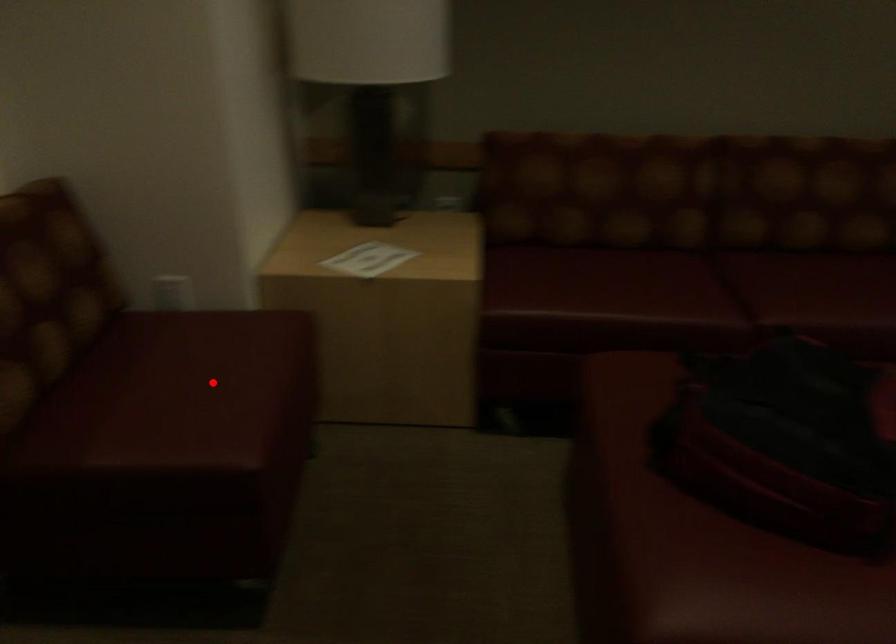
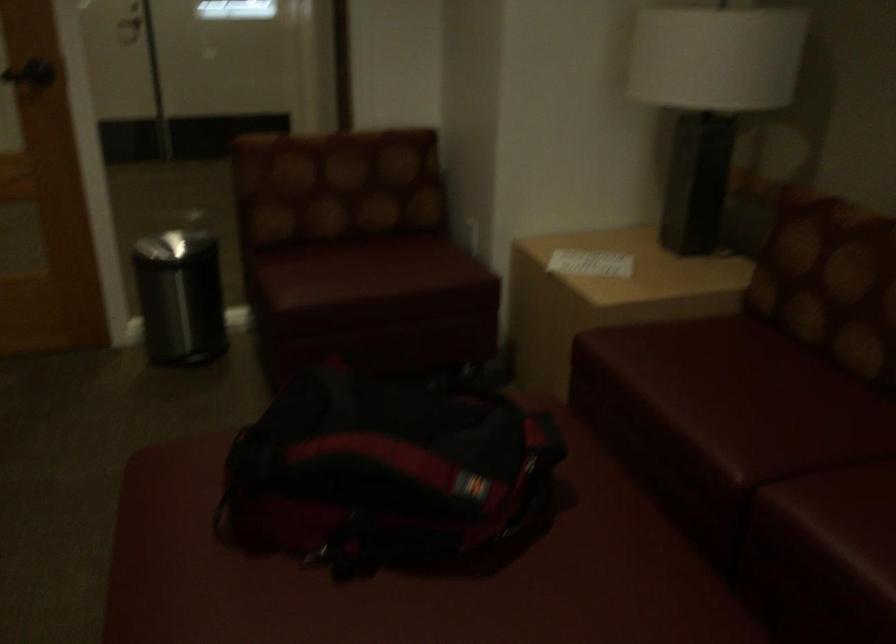
Question: I am providing you with two images of the same scene from different viewpoints. A red point is shown in image1. For the corresponding object point in image2, is it positioned nearer or farther from the camera?

Choices:
 (A) Nearer
 (B) Farther

Answer: (B)